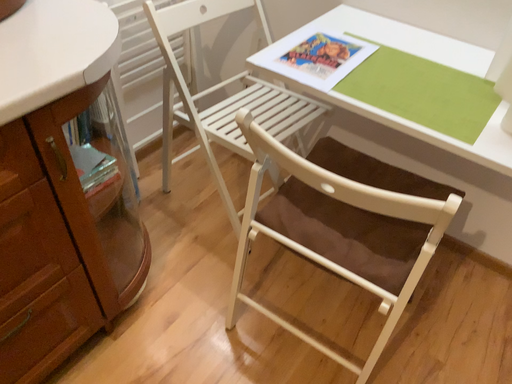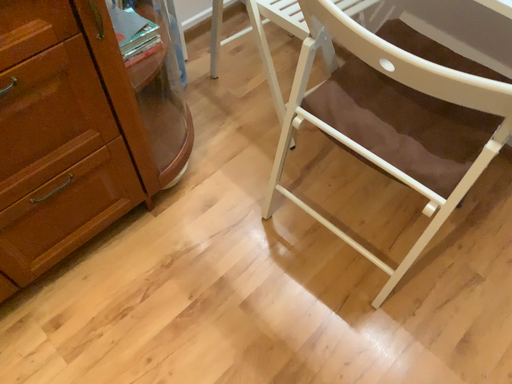
Question: How did the camera likely rotate when shooting the video?

Choices:
 (A) rotated right
 (B) rotated left

Answer: (B)